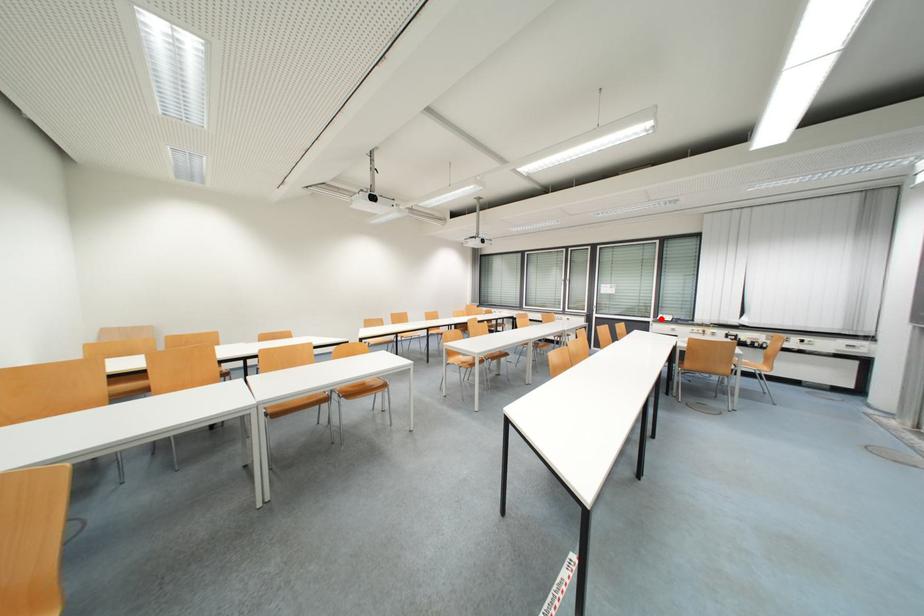
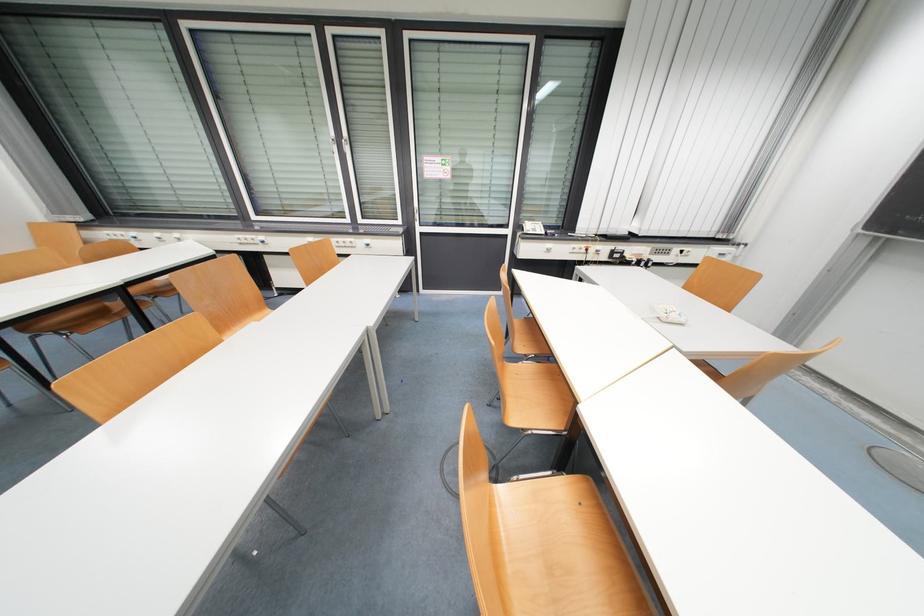
Where in the second image is the point corresponding to the highlighted location from the first image?

(524, 229)